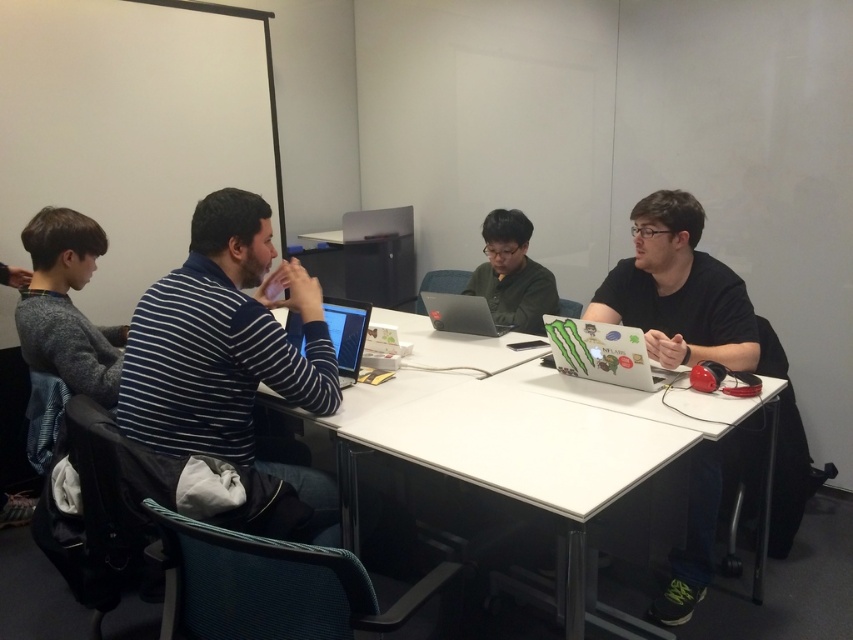
You are organizing a meeting and need to seat two people at a table. You have a gray sweater at left and a satin black laptop at center. Which object takes up more space on the table?

The satin black laptop at center takes up more space on the table because the gray sweater at left is narrower than the satin black laptop at center.

You are a service robot with a height of 1.5 meters. You are positioned in front of the white glossy table at center. Can you comfortably stand upright without bending your head?

The distance between you and the white glossy table at center is 1.42 meters, which is less than your height of 1.5 meters. Therefore, you can stand upright without bending your head.

You are a new employee attending a meeting. You need to access your laptop but see both the green matte sweater at center and the matte black laptop at center. Which object is closer to you?

The green matte sweater at center is closer to you because the matte black laptop at center is behind it.